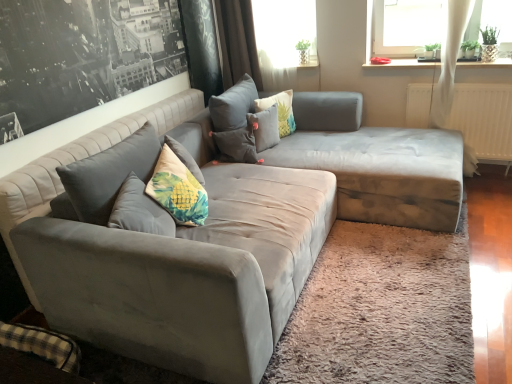
Question: Is white sheer curtain at upper center smaller than fluffy fabric pillow at center, placed as the second pillow when sorted from left to right?

Choices:
 (A) yes
 (B) no

Answer: (B)

Question: Can fluffy fabric pillow at center, placed as the second pillow when sorted from left to right, be found inside white sheer curtain at upper center?

Choices:
 (A) no
 (B) yes

Answer: (A)

Question: Is white sheer curtain at upper center behind fluffy fabric pillow at center, the second pillow positioned from the right?

Choices:
 (A) yes
 (B) no

Answer: (A)

Question: From a real-world perspective, does white sheer curtain at upper center sit lower than fluffy fabric pillow at center, placed as the second pillow when sorted from left to right?

Choices:
 (A) yes
 (B) no

Answer: (B)

Question: From the image's perspective, is white sheer curtain at upper center under fluffy fabric pillow at center, the second pillow positioned from the right?

Choices:
 (A) yes
 (B) no

Answer: (B)

Question: Can you confirm if white sheer curtain at upper center is shorter than fluffy fabric pillow at center, the second pillow positioned from the right?

Choices:
 (A) no
 (B) yes

Answer: (A)

Question: Is brown velvet curtain at upper center inside suede gray couch at center?

Choices:
 (A) yes
 (B) no

Answer: (B)

Question: Considering the relative positions of suede gray couch at center and brown velvet curtain at upper center in the image provided, is suede gray couch at center to the left of brown velvet curtain at upper center from the viewer's perspective?

Choices:
 (A) no
 (B) yes

Answer: (A)

Question: Is suede gray couch at center positioned with its back to brown velvet curtain at upper center?

Choices:
 (A) no
 (B) yes

Answer: (A)

Question: Are suede gray couch at center and brown velvet curtain at upper center beside each other?

Choices:
 (A) yes
 (B) no

Answer: (B)

Question: Is suede gray couch at center oriented towards brown velvet curtain at upper center?

Choices:
 (A) yes
 (B) no

Answer: (B)

Question: Does suede gray couch at center have a lesser height compared to brown velvet curtain at upper center?

Choices:
 (A) yes
 (B) no

Answer: (A)

Question: Can you confirm if floral fabric pillow at center, the 1th pillow from the right, is positioned to the right of fluffy fabric pillow at center, the second pillow positioned from the right?

Choices:
 (A) yes
 (B) no

Answer: (A)